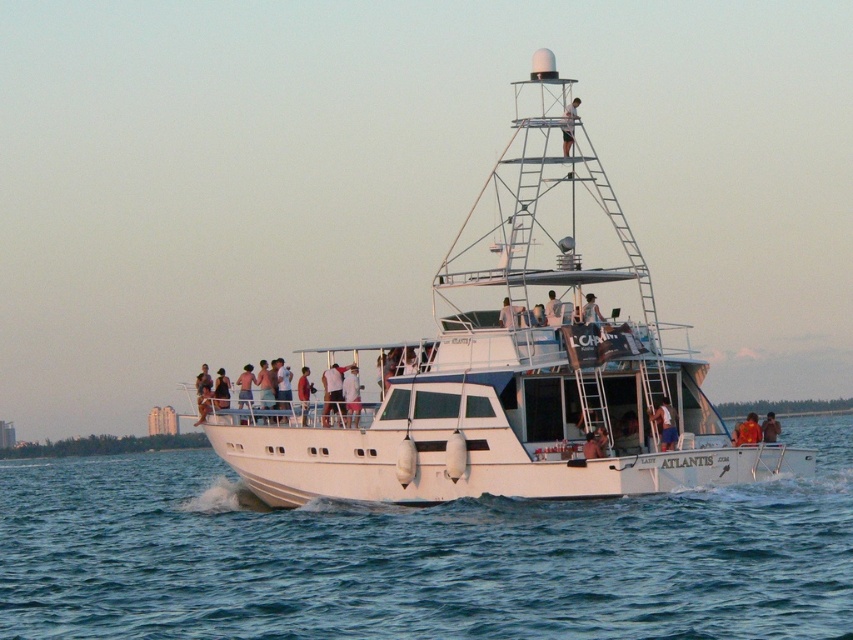
Question: Can you confirm if matte white shirt at center is smaller than metallic silver ladder at upper center?

Choices:
 (A) yes
 (B) no

Answer: (A)

Question: Does white smooth water at center appear over matte white shirt at center?

Choices:
 (A) no
 (B) yes

Answer: (A)

Question: Can you confirm if brown leather jacket at center is thinner than white fabric shirt at upper center?

Choices:
 (A) no
 (B) yes

Answer: (A)

Question: Which object is farther from the camera taking this photo?

Choices:
 (A) white fabric shirt at center
 (B) blue fabric shirt at center
 (C) white smooth water at center
 (D) red fabric shirt at center

Answer: (D)

Question: Which point is closer to the camera?

Choices:
 (A) white matte shirt at upper center
 (B) white smooth water at center
 (C) white fabric shirt at upper center

Answer: (B)

Question: Which of the following is the farthest from the observer?

Choices:
 (A) (561, 134)
 (B) (547, 317)

Answer: (A)